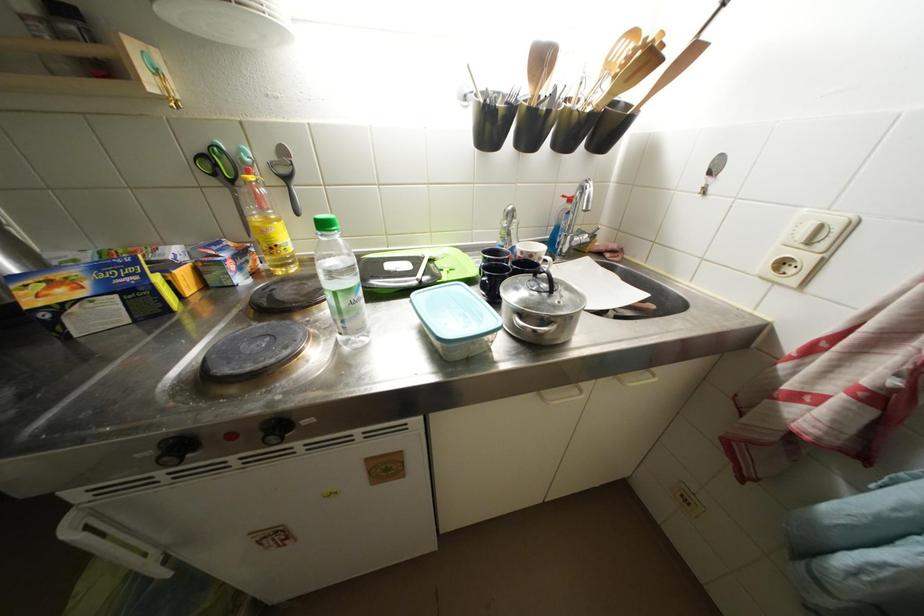
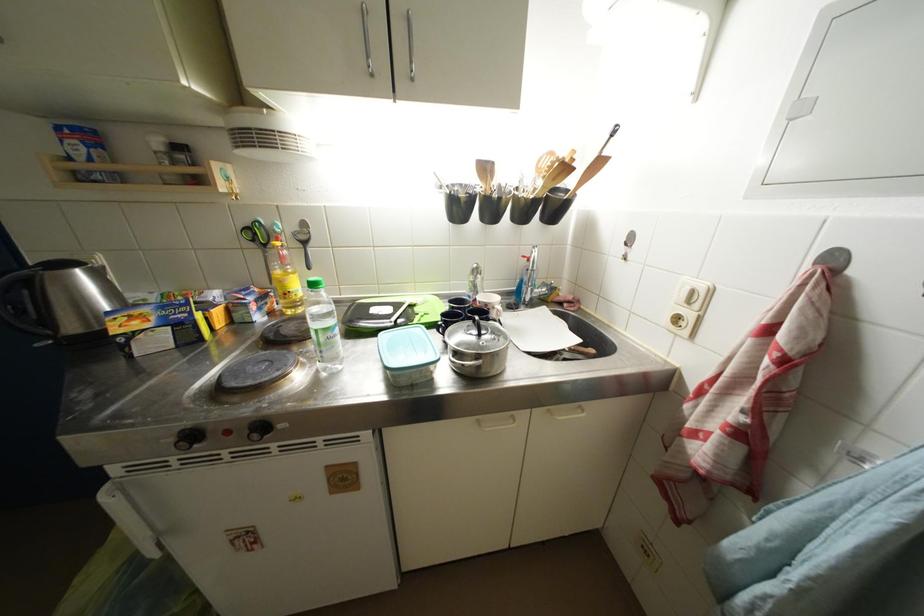
Find the pixel in the second image that matches pixel 208 151 in the first image.

(253, 227)